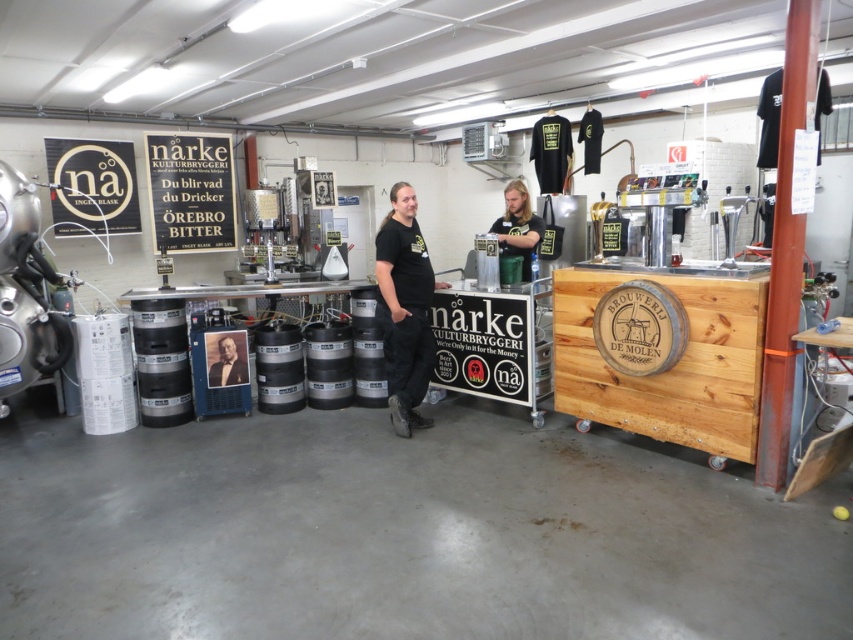
Which of these two, black matte shirt at center or formal black suit at center, stands taller?

black matte shirt at center

What do you see at coordinates (404, 308) in the screenshot? I see `black matte shirt at center` at bounding box center [404, 308].

Where is `black matte shirt at center`? black matte shirt at center is located at coordinates coord(404,308).

Can you confirm if dark brown leather jacket at center is positioned above formal black suit at center?

Yes.

I want to click on dark brown leather jacket at center, so click(x=518, y=227).

Between black matte shirt at center and dark brown leather jacket at center, which one appears on the left side from the viewer's perspective?

Positioned to the left is black matte shirt at center.

Is point (392, 289) in front of point (527, 280)?

Yes, it is in front of point (527, 280).

Does point (410, 324) come behind point (527, 252)?

No, it is in front of (527, 252).

Where is `black matte shirt at center`? Image resolution: width=853 pixels, height=640 pixels. black matte shirt at center is located at coordinates (404, 308).